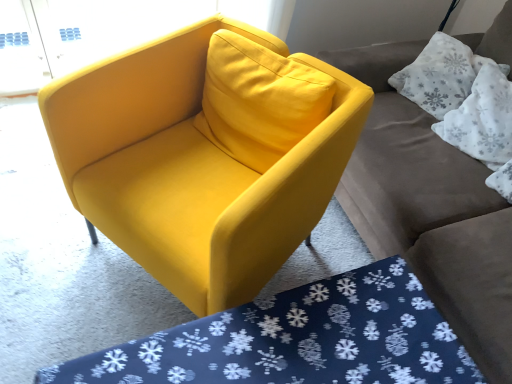
Question: From the image's perspective, is white textured pillow at upper right, the 2th pillow positioned from the bottom, on top of white fabric pillow at upper right, placed as the 2th pillow when sorted from top to bottom?

Choices:
 (A) no
 (B) yes

Answer: (B)

Question: From a real-world perspective, is white textured pillow at upper right, the 2th pillow positioned from the bottom, on top of white fabric pillow at upper right, the first pillow in the bottom-to-top sequence?

Choices:
 (A) yes
 (B) no

Answer: (B)

Question: Can you confirm if white textured pillow at upper right, acting as the first pillow starting from the top, is shorter than white fabric pillow at upper right, the first pillow in the bottom-to-top sequence?

Choices:
 (A) no
 (B) yes

Answer: (A)

Question: Is white textured pillow at upper right, the 2th pillow positioned from the bottom, positioned with its back to white fabric pillow at upper right, the first pillow in the bottom-to-top sequence?

Choices:
 (A) yes
 (B) no

Answer: (B)

Question: Is white textured pillow at upper right, the 2th pillow positioned from the bottom, in contact with white fabric pillow at upper right, placed as the 2th pillow when sorted from top to bottom?

Choices:
 (A) yes
 (B) no

Answer: (B)

Question: Is white textured pillow at upper right, acting as the first pillow starting from the top, wider than white fabric pillow at upper right, the first pillow in the bottom-to-top sequence?

Choices:
 (A) yes
 (B) no

Answer: (A)

Question: Is there a large distance between white fabric pillow at upper right, the first pillow in the bottom-to-top sequence, and matte gray couch at upper right?

Choices:
 (A) yes
 (B) no

Answer: (B)

Question: Can you confirm if white fabric pillow at upper right, the first pillow in the bottom-to-top sequence, is thinner than matte gray couch at upper right?

Choices:
 (A) yes
 (B) no

Answer: (A)

Question: Is white fabric pillow at upper right, placed as the 2th pillow when sorted from top to bottom, touching matte gray couch at upper right?

Choices:
 (A) yes
 (B) no

Answer: (B)

Question: From a real-world perspective, is white fabric pillow at upper right, the first pillow in the bottom-to-top sequence, beneath matte gray couch at upper right?

Choices:
 (A) no
 (B) yes

Answer: (A)

Question: Considering the relative positions of white fabric pillow at upper right, the first pillow in the bottom-to-top sequence, and matte gray couch at upper right in the image provided, is white fabric pillow at upper right, the first pillow in the bottom-to-top sequence, behind matte gray couch at upper right?

Choices:
 (A) yes
 (B) no

Answer: (A)

Question: Does white fabric pillow at upper right, the first pillow in the bottom-to-top sequence, contain matte gray couch at upper right?

Choices:
 (A) yes
 (B) no

Answer: (B)

Question: From the image's perspective, is white textured pillow at upper right, the 2th pillow positioned from the bottom, under matte yellow armchair at center?

Choices:
 (A) yes
 (B) no

Answer: (B)